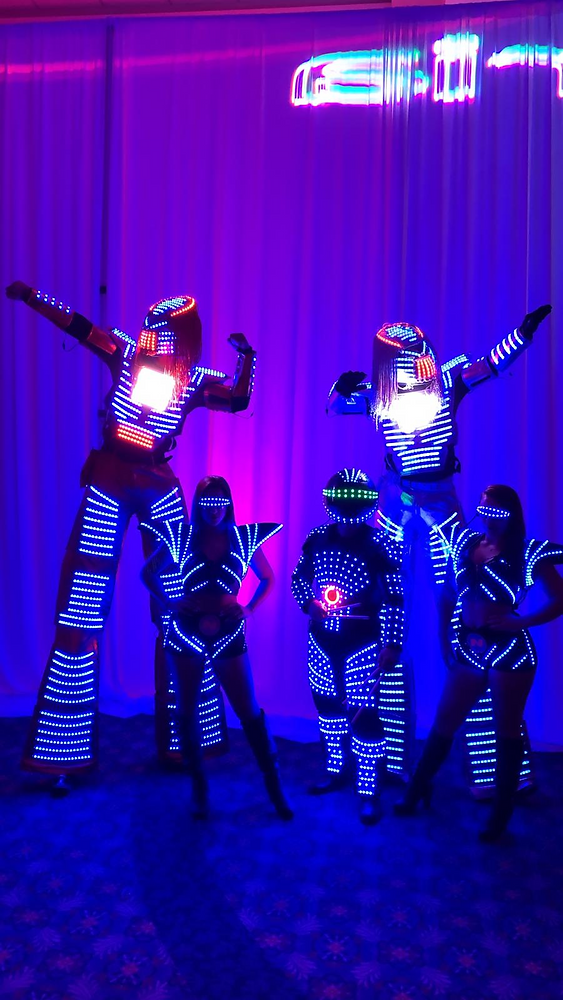
The height and width of the screenshot is (1000, 563). Identify the location of floor. (122, 907).